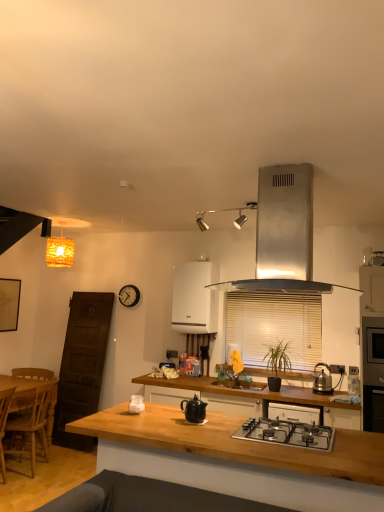
The width and height of the screenshot is (384, 512). What are the coordinates of `free space to the left of black ceramic teapot at center, the 2th kitchen appliance positioned from the left` in the screenshot? It's located at (172, 418).